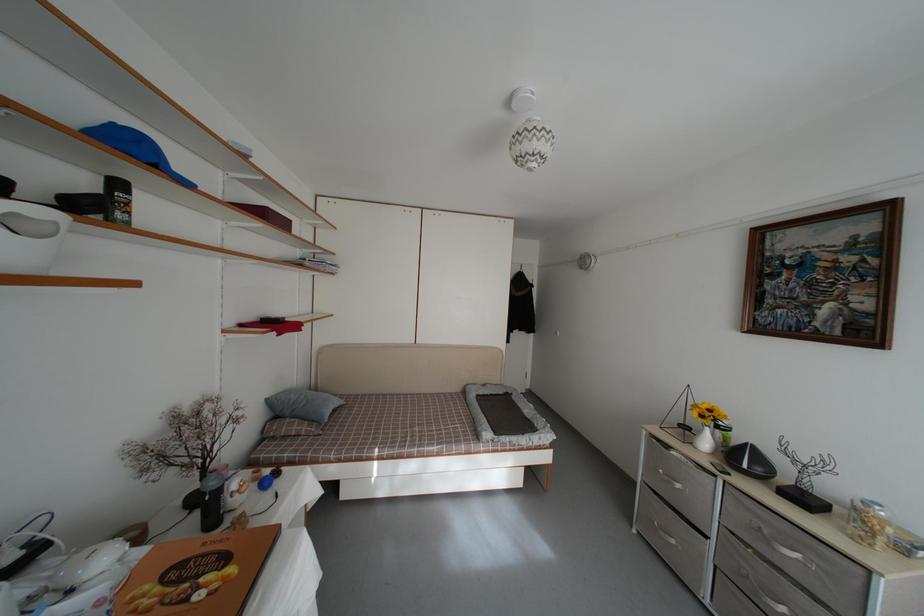
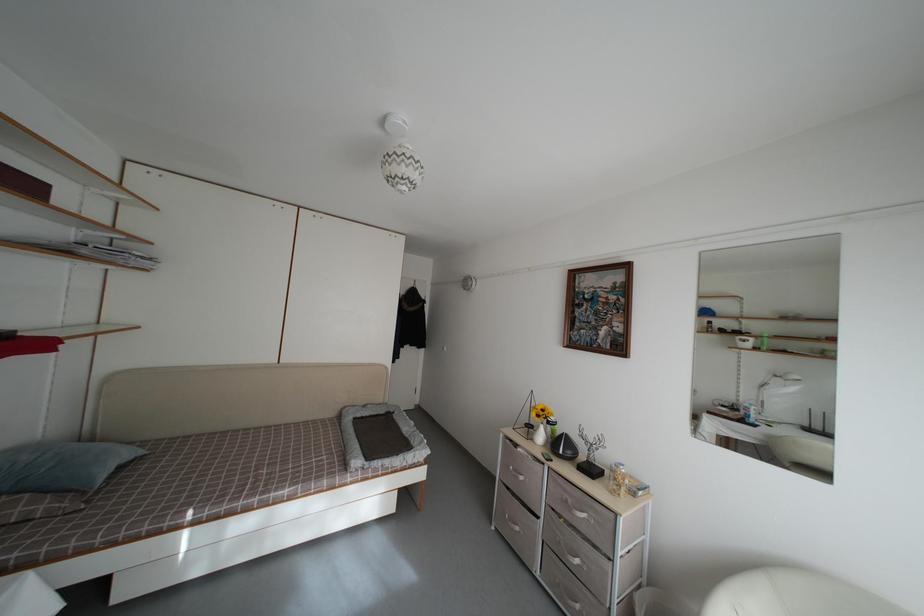
Question: The images are taken continuously from a first-person perspective. In which direction is your viewpoint rotating?

Choices:
 (A) Left
 (B) Right
 (C) Up
 (D) Down

Answer: (B)